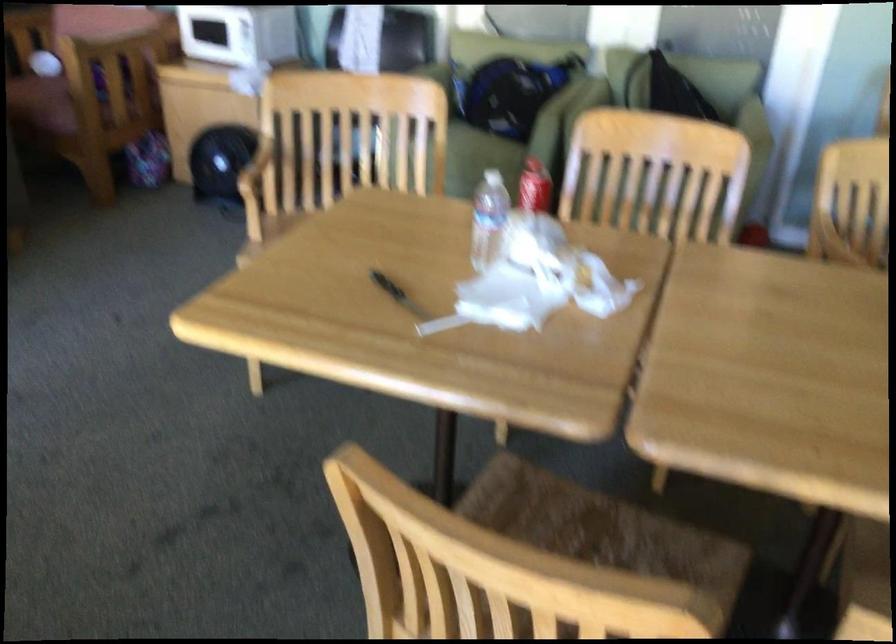
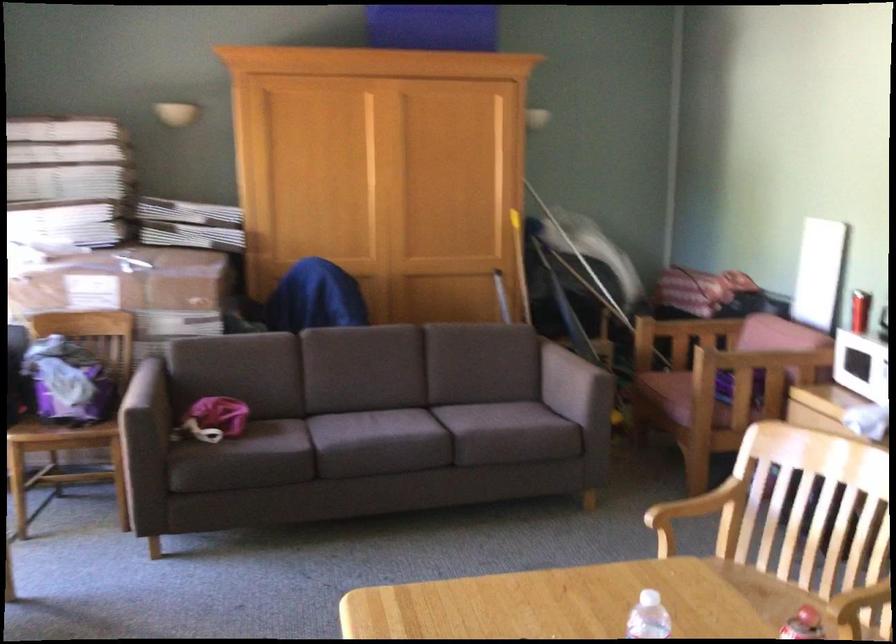
Find the pixel in the second image that matches [419,187] in the first image.

(860, 609)